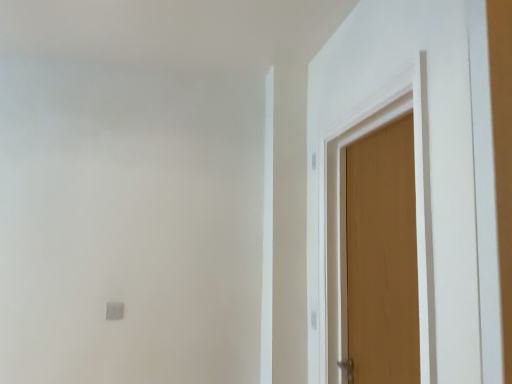
Question: Visually, is wooden door at right, the 1th door from the left, positioned to the left or to the right of wooden door at right, which ranks as the 1th door in right-to-left order?

Choices:
 (A) left
 (B) right

Answer: (A)

Question: Is wooden door at right, the 1th door from the left, in front of or behind wooden door at right, which ranks as the 1th door in right-to-left order, in the image?

Choices:
 (A) behind
 (B) front

Answer: (B)

Question: Considering the positions of wooden door at right, the 1th door from the left, and wooden door at right, acting as the 2th door starting from the left, in the image, is wooden door at right, the 1th door from the left, wider or thinner than wooden door at right, acting as the 2th door starting from the left,?

Choices:
 (A) thin
 (B) wide

Answer: (A)

Question: From a real-world perspective, is wooden door at right, acting as the 2th door starting from the left, above or below wooden door at right, the 2th door positioned from the right?

Choices:
 (A) above
 (B) below

Answer: (B)

Question: Would you say wooden door at right, which ranks as the 1th door in right-to-left order, is inside or outside wooden door at right, the 2th door positioned from the right?

Choices:
 (A) outside
 (B) inside

Answer: (A)

Question: Does point (362, 221) appear closer or farther from the camera than point (310, 66)?

Choices:
 (A) farther
 (B) closer

Answer: (B)

Question: In terms of height, does wooden door at right, acting as the 2th door starting from the left, look taller or shorter compared to wooden door at right, the 1th door from the left?

Choices:
 (A) tall
 (B) short

Answer: (B)